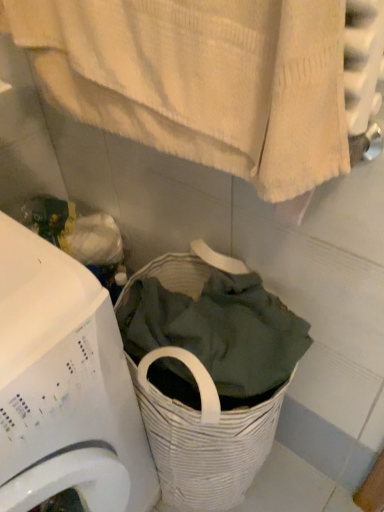
Question: Does point (69, 298) appear closer or farther from the camera than point (218, 113)?

Choices:
 (A) farther
 (B) closer

Answer: (A)

Question: From a real-world perspective, is white plastic washing machine at lower left above or below white textured towel at upper center?

Choices:
 (A) below
 (B) above

Answer: (A)

Question: Considering the positions of white plastic washing machine at lower left and white textured towel at upper center in the image, is white plastic washing machine at lower left taller or shorter than white textured towel at upper center?

Choices:
 (A) short
 (B) tall

Answer: (B)

Question: Is white textured towel at upper center to the left or to the right of white plastic washing machine at lower left in the image?

Choices:
 (A) left
 (B) right

Answer: (B)

Question: Looking at their shapes, would you say white textured towel at upper center is wider or thinner than white plastic washing machine at lower left?

Choices:
 (A) thin
 (B) wide

Answer: (A)

Question: Is point (130, 80) closer or farther from the camera than point (99, 401)?

Choices:
 (A) farther
 (B) closer

Answer: (B)

Question: Is white textured towel at upper center in front of or behind white plastic washing machine at lower left in the image?

Choices:
 (A) front
 (B) behind

Answer: (A)